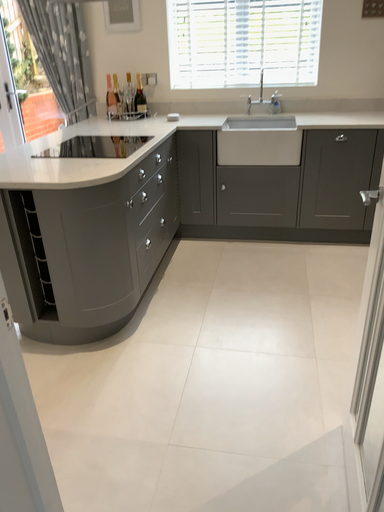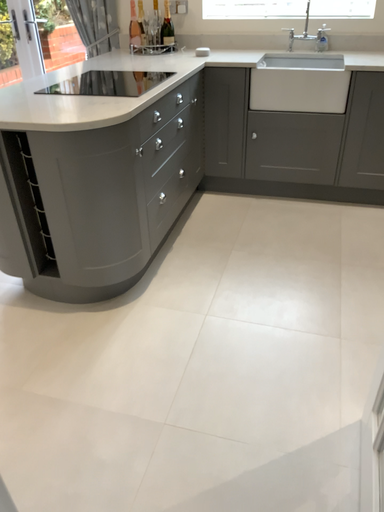
Question: Which way did the camera rotate in the video?

Choices:
 (A) rotated downward
 (B) rotated upward

Answer: (A)